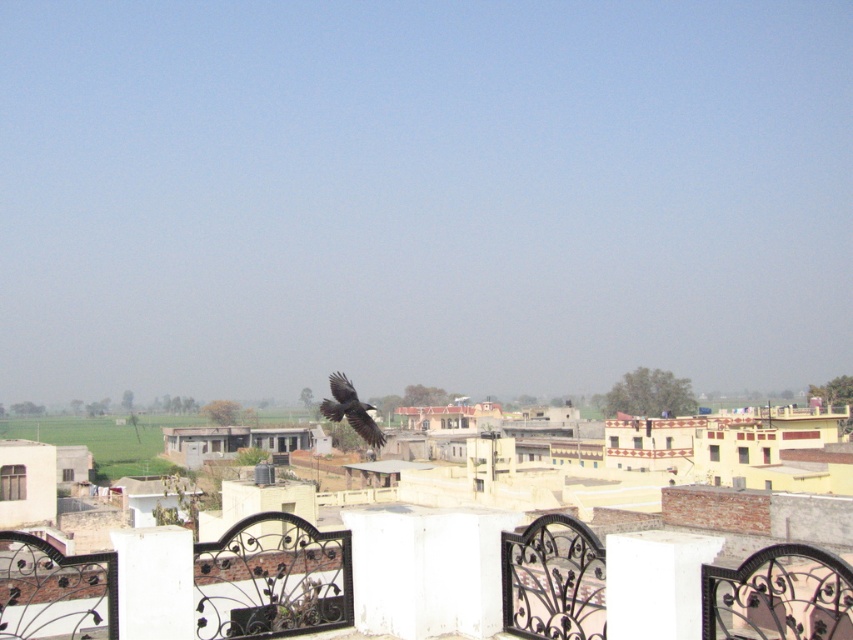
Question: Is white painted concrete pillar at center wider than black glossy crow at center?

Choices:
 (A) no
 (B) yes

Answer: (A)

Question: Considering the real-world distances, which object is closest to the white painted concrete pillar at center?

Choices:
 (A) black wrought iron fence at lower center
 (B) white matte pillar at lower left
 (C) white smooth pillar at center
 (D) black glossy crow at center

Answer: (C)

Question: Among these points, which one is nearest to the camera?

Choices:
 (A) (422, 637)
 (B) (402, 568)
 (C) (349, 424)

Answer: (A)

Question: Does black wrought iron fence at lower center have a lesser width compared to black glossy crow at center?

Choices:
 (A) yes
 (B) no

Answer: (B)

Question: Can you confirm if black wrought iron fence at lower center is positioned below white smooth pillar at center?

Choices:
 (A) yes
 (B) no

Answer: (A)

Question: Which object appears closest to the camera in this image?

Choices:
 (A) white matte pillar at lower left
 (B) white smooth pillar at center
 (C) black glossy crow at center
 (D) black wrought iron fence at lower center

Answer: (D)